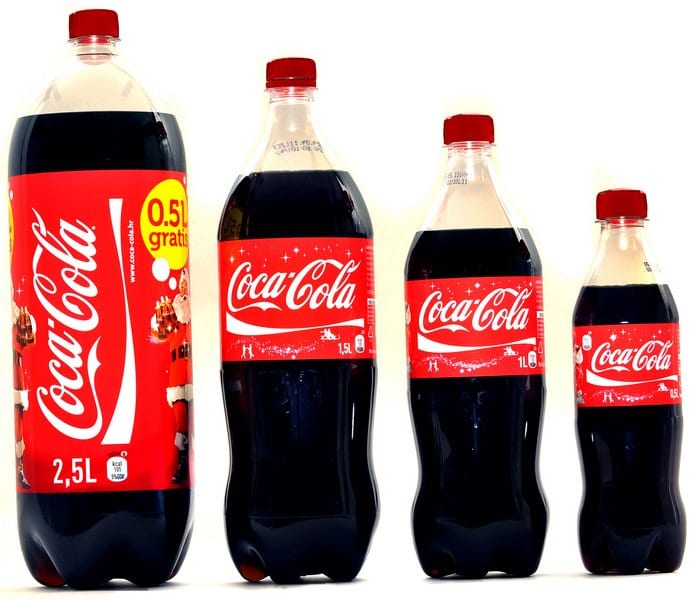
You are a GUI agent. You are given a task and a screenshot of the screen. Output one action in this format:
    pyautogui.click(x=<x>, y=<y>)
    Task: Click on the bottles
    
    Given the screenshot: What is the action you would take?
    pyautogui.click(x=607, y=439), pyautogui.click(x=452, y=484), pyautogui.click(x=283, y=487), pyautogui.click(x=108, y=546)